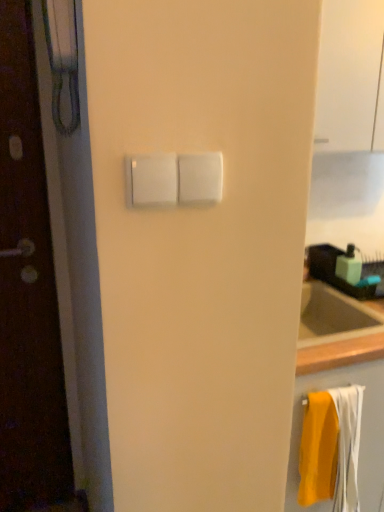
Question: Is transparent glass door at upper right far away from white plastic light switch at center?

Choices:
 (A) yes
 (B) no

Answer: (B)

Question: Is transparent glass door at upper right positioned beyond the bounds of white plastic light switch at center?

Choices:
 (A) no
 (B) yes

Answer: (B)

Question: Are transparent glass door at upper right and white plastic light switch at center making contact?

Choices:
 (A) no
 (B) yes

Answer: (A)

Question: Can you confirm if transparent glass door at upper right is shorter than white plastic light switch at center?

Choices:
 (A) no
 (B) yes

Answer: (A)

Question: Does transparent glass door at upper right have a lesser width compared to white plastic light switch at center?

Choices:
 (A) no
 (B) yes

Answer: (A)

Question: Is transparent glass door at upper right in front of white plastic light switch at center?

Choices:
 (A) no
 (B) yes

Answer: (A)

Question: Is yellow fabric towel at lower right to the right of white plastic light switch at center from the viewer's perspective?

Choices:
 (A) yes
 (B) no

Answer: (A)

Question: Considering the relative sizes of yellow fabric towel at lower right and white plastic light switch at center in the image provided, is yellow fabric towel at lower right bigger than white plastic light switch at center?

Choices:
 (A) yes
 (B) no

Answer: (A)

Question: Is yellow fabric towel at lower right thinner than white plastic light switch at center?

Choices:
 (A) no
 (B) yes

Answer: (A)

Question: From the image's perspective, is yellow fabric towel at lower right on white plastic light switch at center?

Choices:
 (A) no
 (B) yes

Answer: (A)

Question: Is yellow fabric towel at lower right not close to white plastic light switch at center?

Choices:
 (A) no
 (B) yes

Answer: (A)

Question: From a real-world perspective, is yellow fabric towel at lower right physically above white plastic light switch at center?

Choices:
 (A) yes
 (B) no

Answer: (B)

Question: Does green matte soap dispenser at upper right have a lesser width compared to white plastic light switch at center?

Choices:
 (A) yes
 (B) no

Answer: (B)